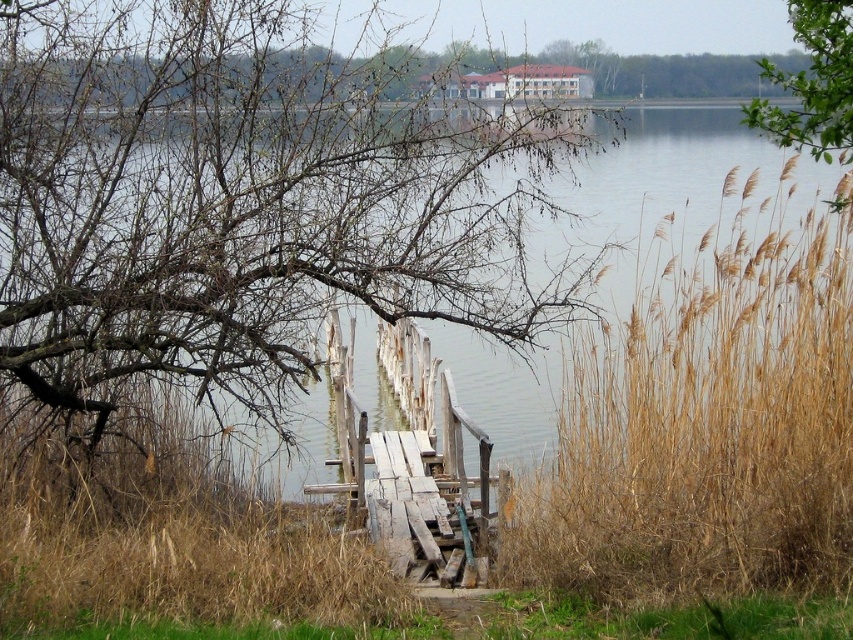
You are standing on the lakeside and want to know if the dry grass at lower center is wider than the bare branches at upper center. Can you determine this based on the scene?

The dry grass at lower center might be wider than the bare branches at upper center according to the scene description.